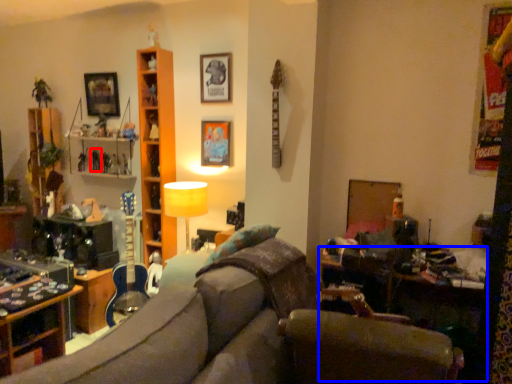
Question: Which of the following is the farthest to the observer, toy (highlighted by a red box) or table (highlighted by a blue box)?

Choices:
 (A) toy
 (B) table

Answer: (A)